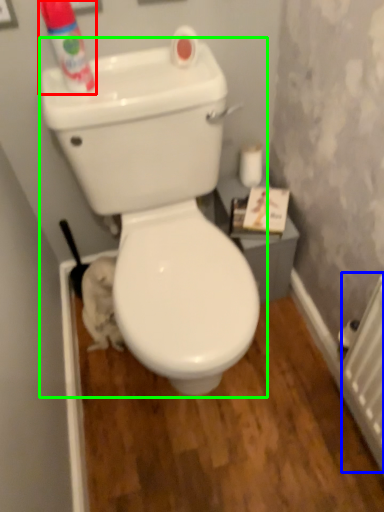
Question: Based on their relative distances, which object is nearer to cleaning product (highlighted by a red box)? Choose from radiator (highlighted by a blue box) and toilet (highlighted by a green box).

Choices:
 (A) radiator
 (B) toilet

Answer: (B)